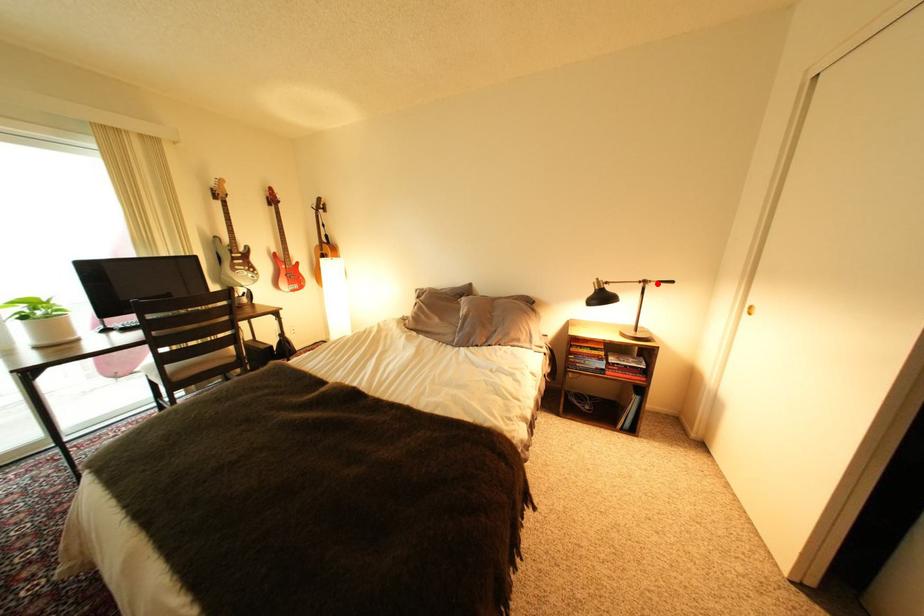
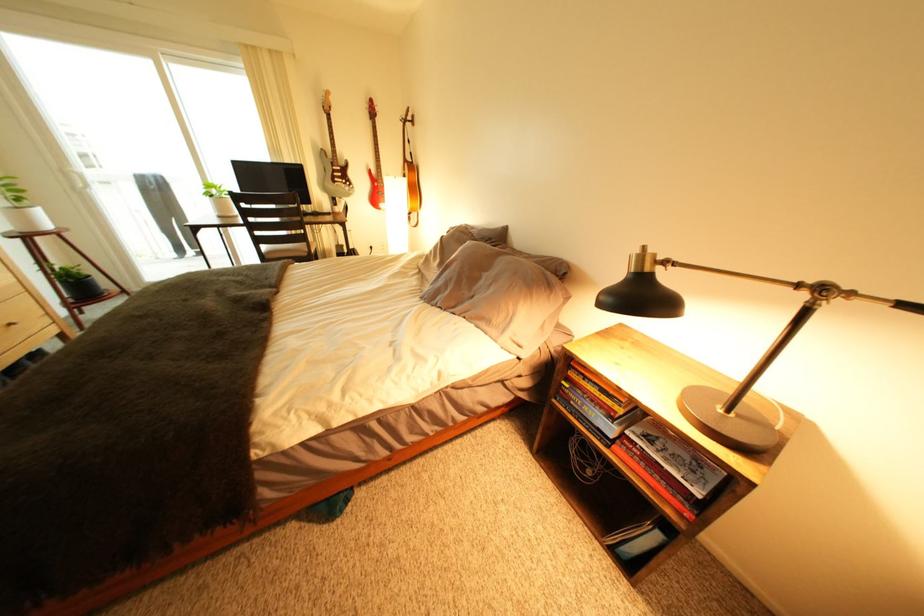
Where in the second image is the point corresponding to the highlighted location from the first image?

(834, 291)